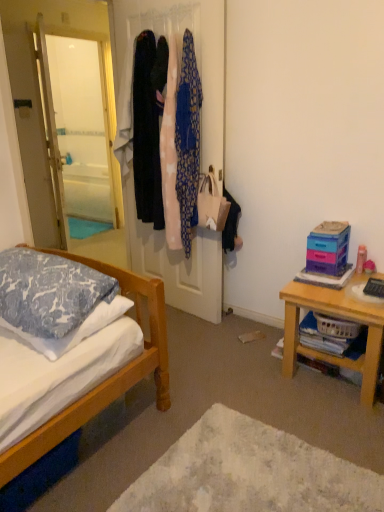
Question: From a real-world perspective, is dark blue fabric dress at center, which is the first clothing from left to right, physically located above or below white soft rug at lower center?

Choices:
 (A) above
 (B) below

Answer: (A)

Question: Considering the positions of point (145, 192) and point (364, 501), is point (145, 192) closer or farther from the camera than point (364, 501)?

Choices:
 (A) farther
 (B) closer

Answer: (A)

Question: Estimate the real-world distances between objects in this image. Which object is farther from the pink fabric at center, the first clothing in the right-to-left sequence?

Choices:
 (A) blue patterned pillow at left, the 2th pillow when ordered from bottom to top
 (B) white soft pillow at lower left, the second pillow from the top
 (C) wooden table at right
 (D) dark blue fabric dress at center, which is the first clothing from left to right
 (E) white soft rug at lower center

Answer: (E)

Question: Considering the real-world distances, which object is farthest from the silky fabric coats at center?

Choices:
 (A) wooden table at right
 (B) pink fabric at center, positioned as the second clothing in left-to-right order
 (C) white soft rug at lower center
 (D) white soft pillow at lower left, acting as the 1th pillow starting from the bottom
 (E) dark blue fabric dress at center, positioned as the third clothing in right-to-left order

Answer: (C)